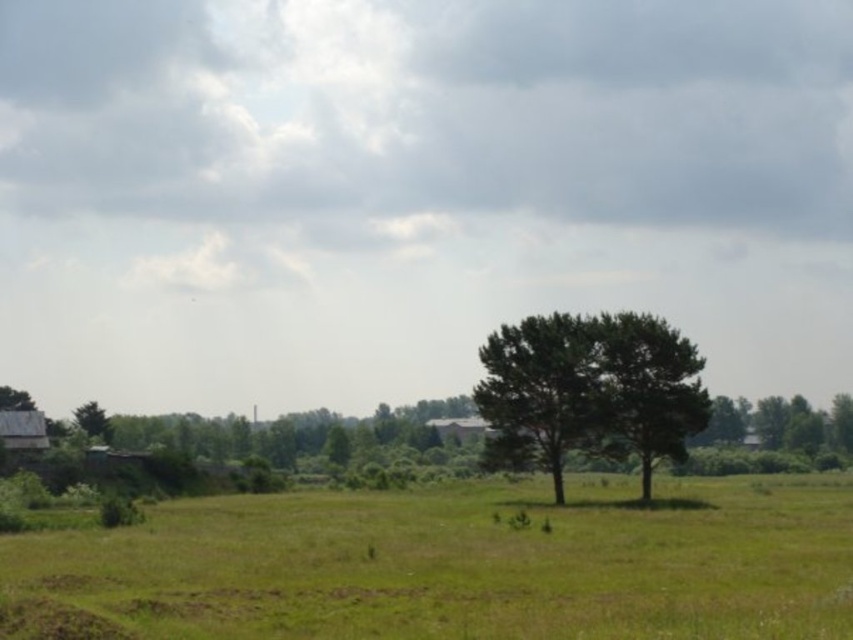
You are a gardener who needs to water both the green grass at lower center and the green leafy tree at center. Your watering can holds enough water for 10 meters of travel. Can you water both without refilling?

The distance between the green grass at lower center and the green leafy tree at center is 10.56 meters. Since your watering can only allows 10 meters of travel, you cannot water both without refilling.

You are a gardener planning to plant a new row of flowers between the green grass at lower center and the green leafy tree at center. Based on their widths, which area would require more space for the flower row?

The green grass at lower center is wider than the green leafy tree at center, so planting the flower row between them would require more space in the area of the green grass at lower center.

You are standing in the middle of the field and see the green grass at lower center and the green leafy tree at center. Which object is closer to you?

The green grass at lower center is closer to you because it is positioned below the green leafy tree at center, indicating it is in the foreground.